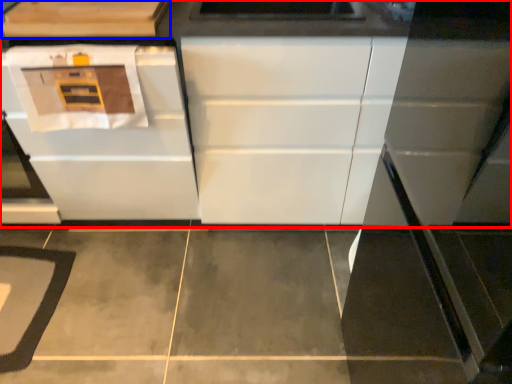
Question: Among these objects, which one is nearest to the camera, cabinetry (highlighted by a red box) or cabinetry (highlighted by a blue box)?

Choices:
 (A) cabinetry
 (B) cabinetry

Answer: (B)